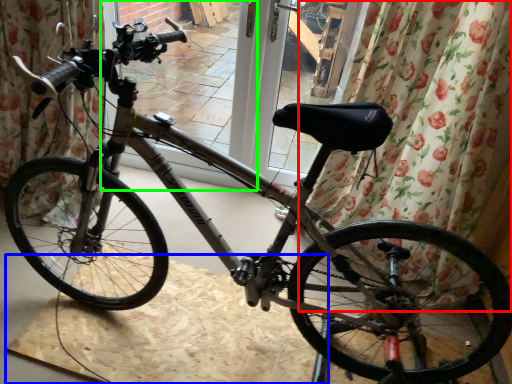
Question: Estimate the real-world distances between objects in this image. Which object is closer to curtain (highlighted by a red box), cardboard (highlighted by a blue box) or screen door (highlighted by a green box)?

Choices:
 (A) cardboard
 (B) screen door

Answer: (A)